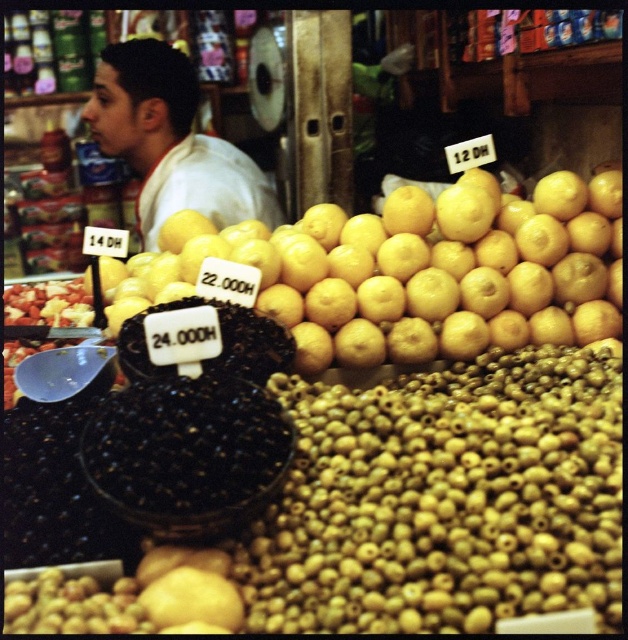
Between yellow matte orange at center and white matte shirt at upper left, which one appears on the left side from the viewer's perspective?

Positioned to the left is white matte shirt at upper left.

Can you confirm if yellow matte orange at center is thinner than white matte shirt at upper left?

Incorrect, yellow matte orange at center's width is not less than white matte shirt at upper left's.

Is point (160, 243) closer to viewer compared to point (95, 129)?

Yes, it is in front of point (95, 129).

Identify the location of yellow matte orange at center. (414, 272).